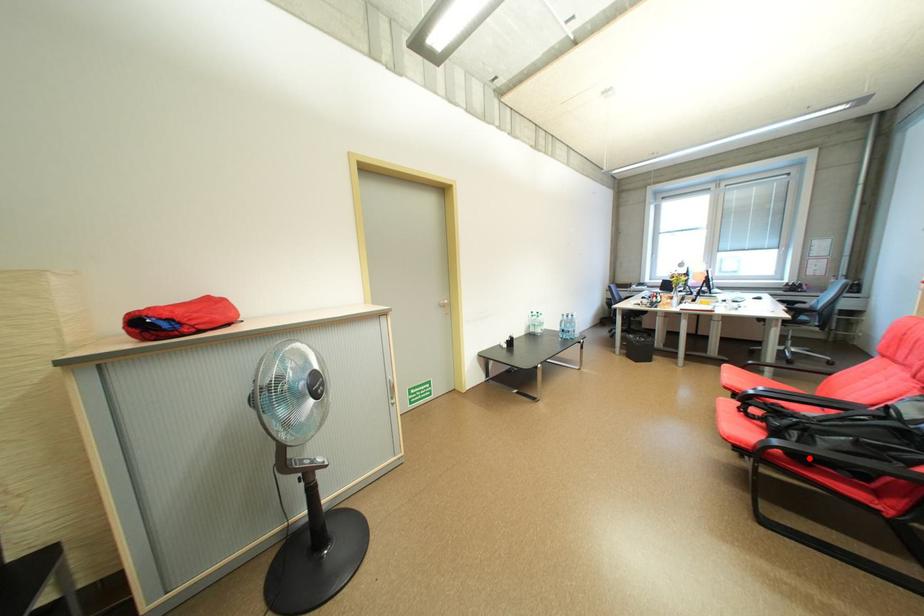
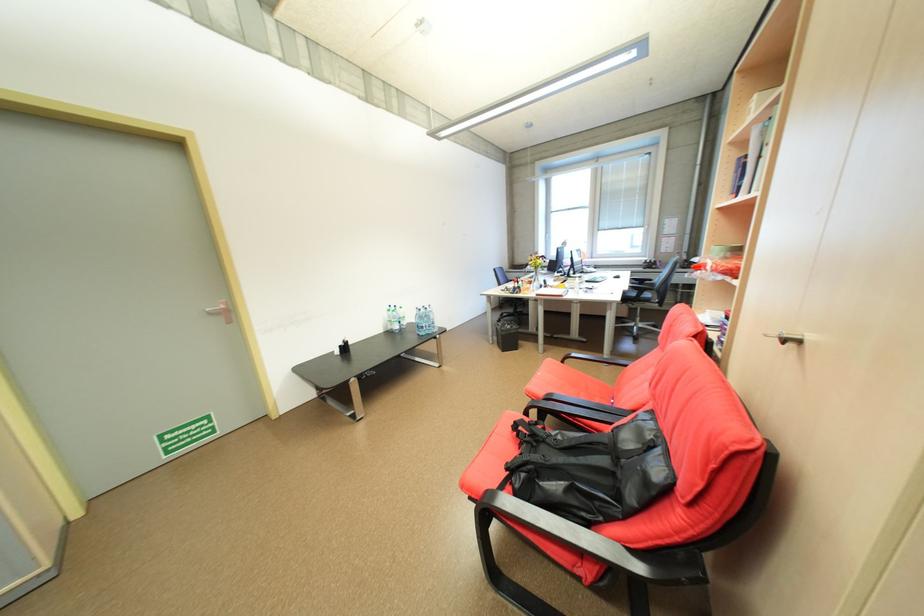
Question: I am providing you with two images of the same scene from different viewpoints. Given a red point in image1, look at the same physical point in image2. Is it:

Choices:
 (A) Closer to the viewpoint
 (B) Farther from the viewpoint

Answer: (B)